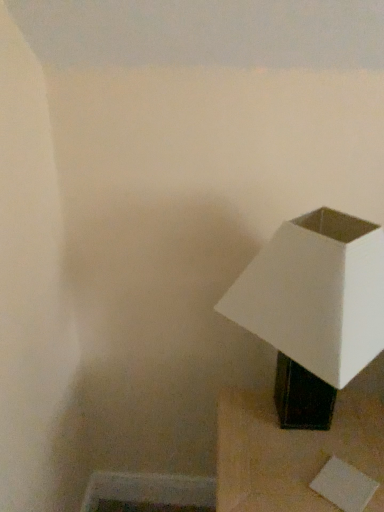
Question: From their relative heights in the image, would you say white matte lampshade at right is taller or shorter than black matte lamp at lower right?

Choices:
 (A) tall
 (B) short

Answer: (A)

Question: From the image's perspective, is white matte lampshade at right located above or below black matte lamp at lower right?

Choices:
 (A) below
 (B) above

Answer: (B)

Question: Relative to black matte lamp at lower right, is white matte lampshade at right in front or behind?

Choices:
 (A) behind
 (B) front

Answer: (B)

Question: From a real-world perspective, relative to white matte lampshade at right, is black matte lamp at lower right vertically above or below?

Choices:
 (A) above
 (B) below

Answer: (B)

Question: Considering the relative positions of black matte lamp at lower right and white matte lampshade at right in the image provided, is black matte lamp at lower right to the left or to the right of white matte lampshade at right?

Choices:
 (A) left
 (B) right

Answer: (B)

Question: Is black matte lamp at lower right spatially inside white matte lampshade at right, or outside of it?

Choices:
 (A) outside
 (B) inside

Answer: (A)

Question: In terms of size, does black matte lamp at lower right appear bigger or smaller than white matte lampshade at right?

Choices:
 (A) big
 (B) small

Answer: (A)